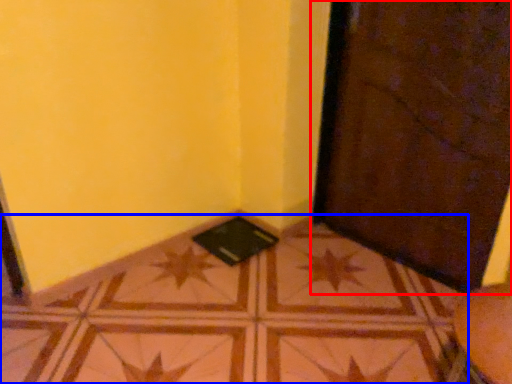
Question: Which object appears farthest to the camera in this image, door (highlighted by a red box) or tile (highlighted by a blue box)?

Choices:
 (A) door
 (B) tile

Answer: (A)